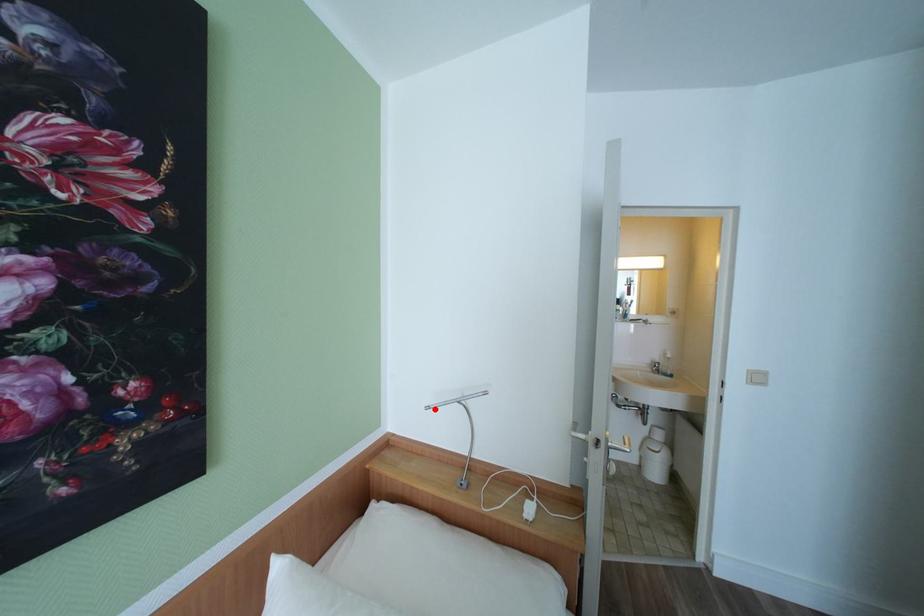
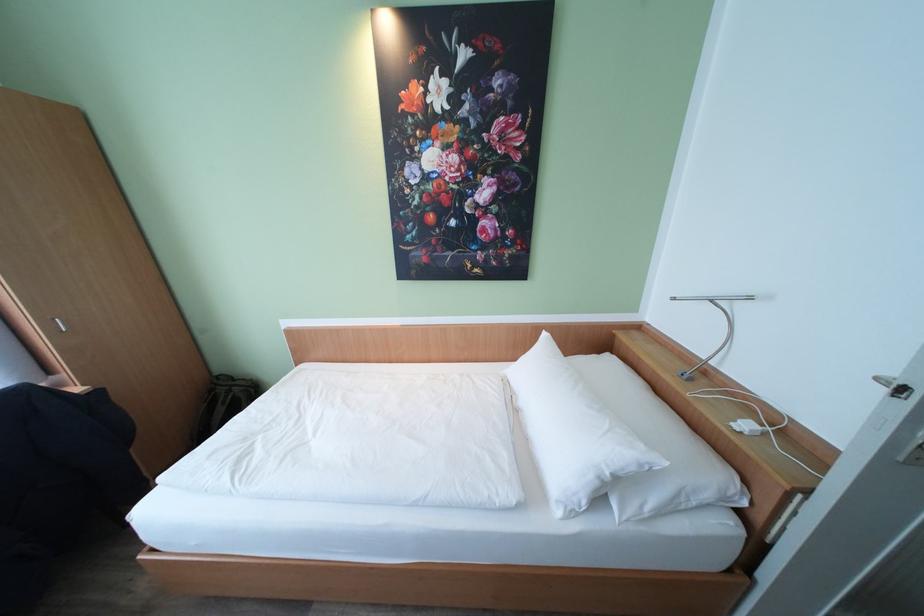
The point at the highlighted location is marked in the first image. Where is the corresponding point in the second image?

(681, 300)